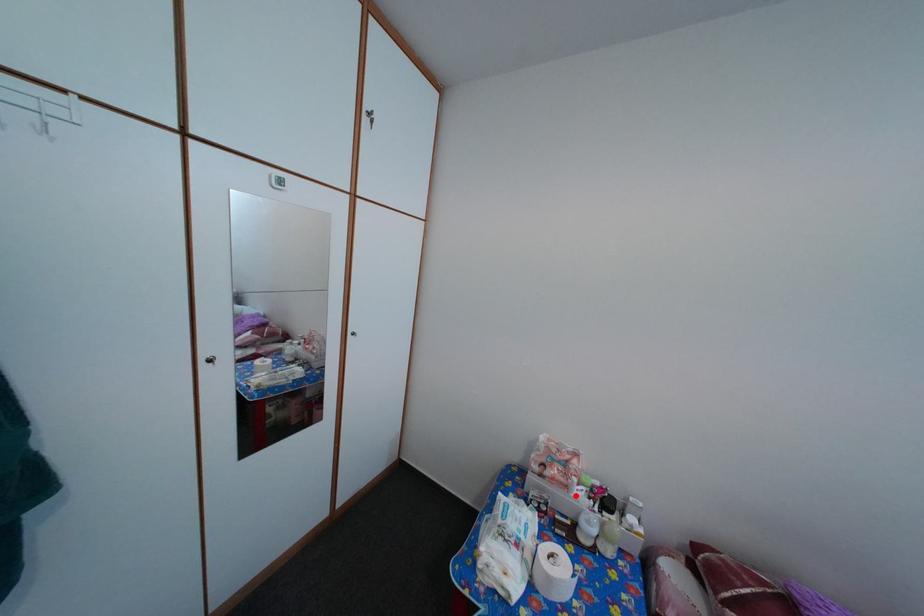
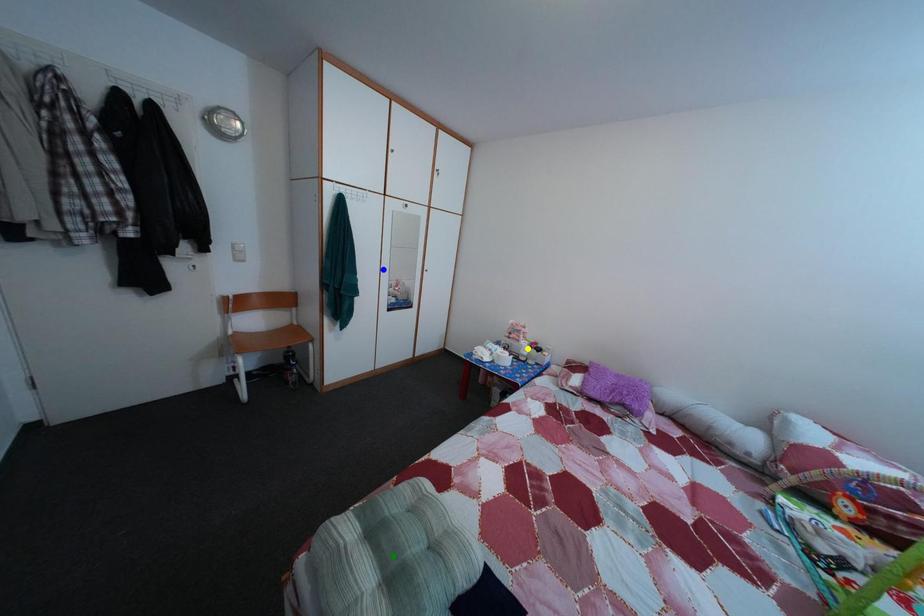
Question: I am providing you with two images of the same scene from different viewpoints. A red point is marked on the first image. You are given multiple points on the second image. Which point in image 2 represents the same 3d spot as the red point in image 1?

Choices:
 (A) green point
 (B) yellow point
 (C) blue point

Answer: (B)